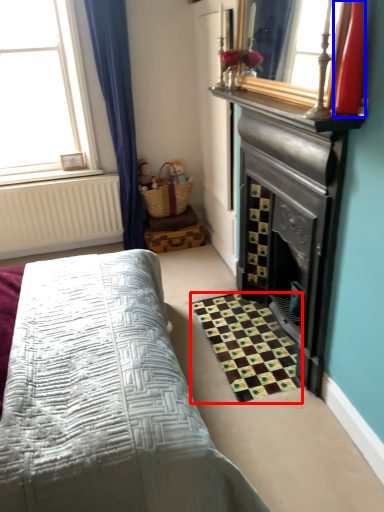
Question: Which of the following is the farthest to the observer, pattern (highlighted by a red box) or chiffonier (highlighted by a blue box)?

Choices:
 (A) pattern
 (B) chiffonier

Answer: (A)